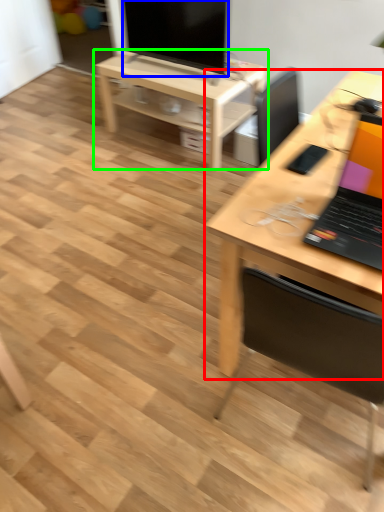
Question: Based on their relative distances, which object is nearer to desk (highlighted by a red box)? Choose from television (highlighted by a blue box) and table (highlighted by a green box).

Choices:
 (A) television
 (B) table

Answer: (B)